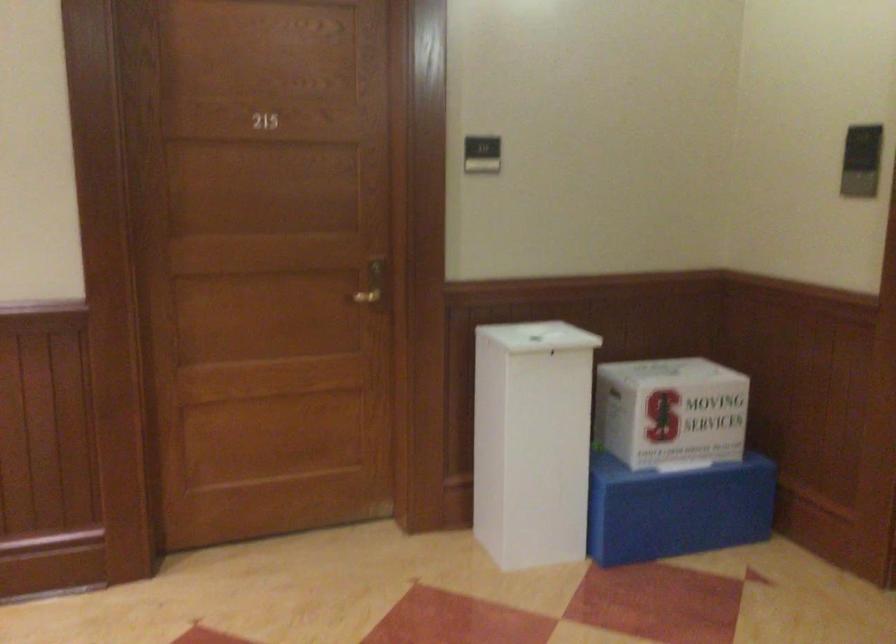
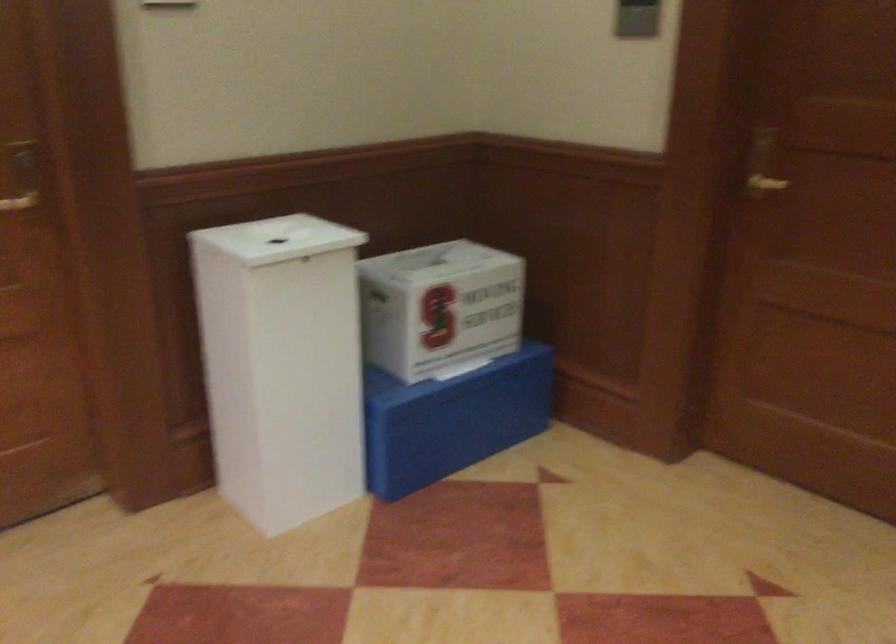
Question: Based on the continuous images, in which direction is the camera rotating? Reply with the corresponding letter.

Choices:
 (A) Left
 (B) Right
 (C) Up
 (D) Down

Answer: (B)